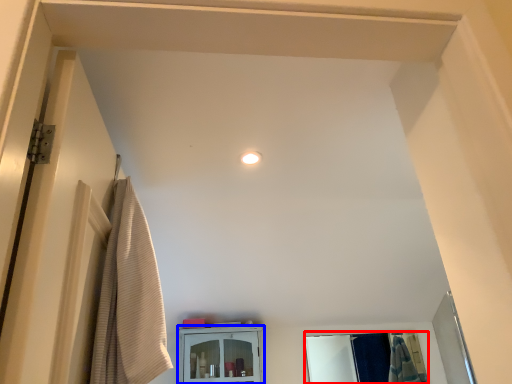
Question: Among these objects, which one is nearest to the camera, mirror (highlighted by a red box) or cabinetry (highlighted by a blue box)?

Choices:
 (A) mirror
 (B) cabinetry

Answer: (B)